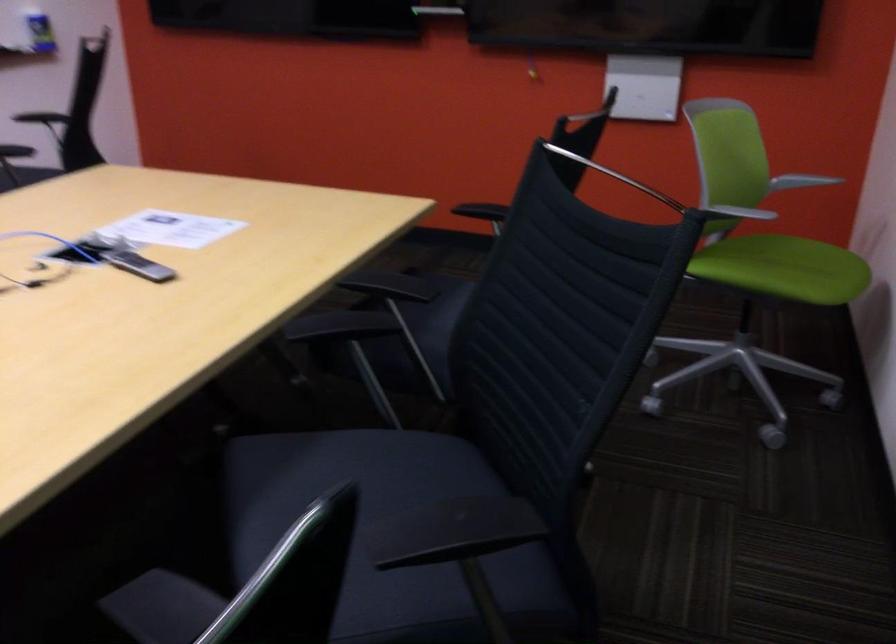
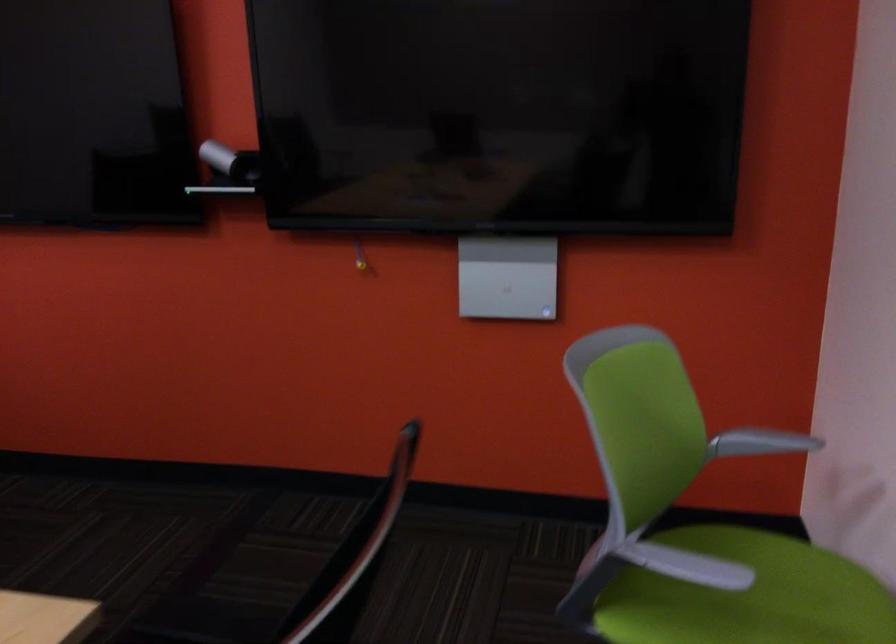
In the second image, find the point that corresponds to pixel 779 263 in the first image.

(747, 596)